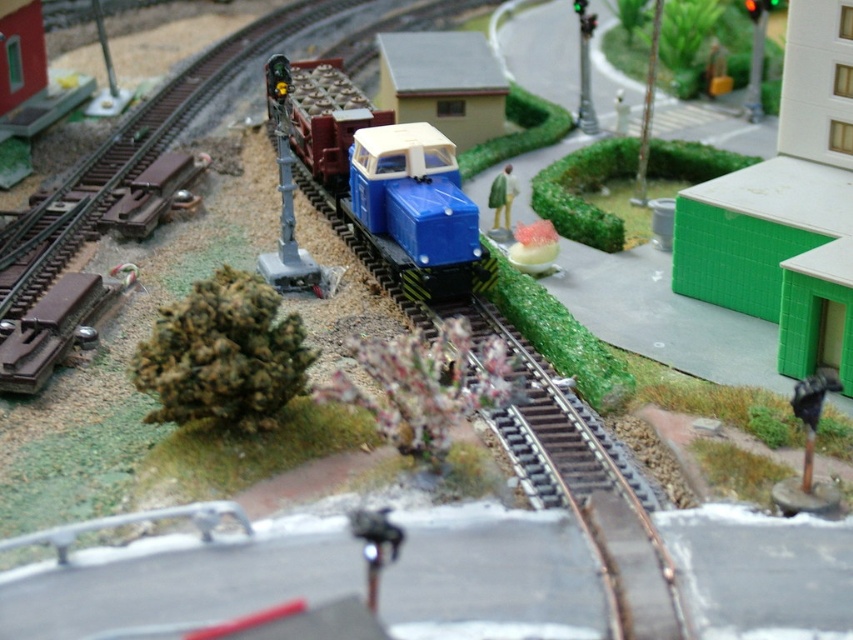
Which is above, metallic gray signal light at upper left or green matte figure at center?

metallic gray signal light at upper left

Does metallic gray signal light at upper left lie in front of green matte figure at center?

Yes, it is in front of green matte figure at center.

Who is more distant from viewer, (309, 275) or (506, 220)?

The point (506, 220) is more distant.

Identify the location of metallic gray signal light at upper left. This screenshot has height=640, width=853. (286, 193).

Looking at this image, is blue plastic train at center smaller than blue plastic train car at center?

Actually, blue plastic train at center might be larger than blue plastic train car at center.

Which is in front, point (270, 65) or point (373, 241)?

Point (270, 65)

This screenshot has width=853, height=640. What are the coordinates of `blue plastic train at center` in the screenshot? It's located at (387, 180).

Is point (276, 102) closer to viewer compared to point (492, 227)?

Yes, it is.

In order to click on blue plastic train at center in this screenshot , I will do `click(387, 180)`.